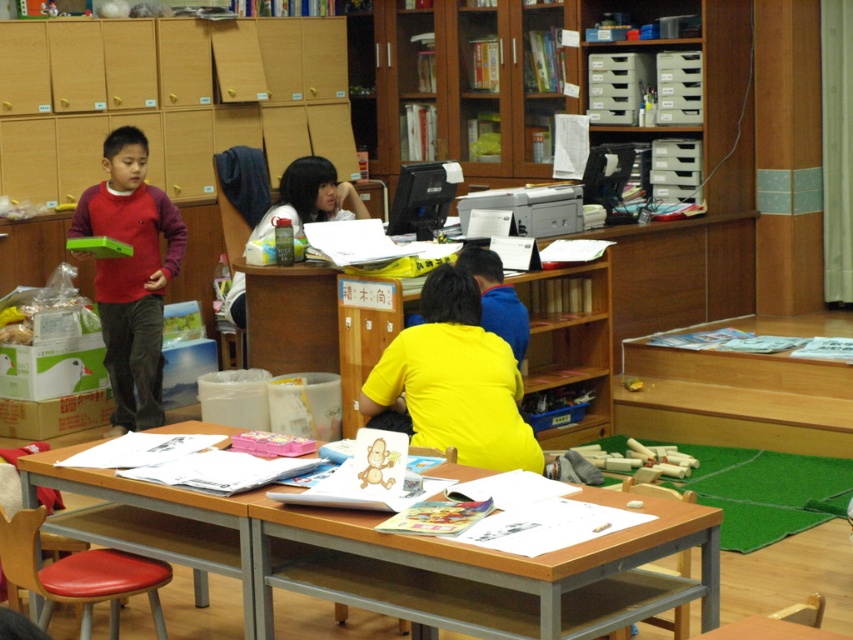
You are a teacher in the classroom and need to place a new poster on the wall. The poster is the same size as the matte red sweater at left. Will the wooden at center desk be able to accommodate the poster if you want to place it there instead?

The wooden at center is bigger than the matte red sweater at left, so the poster will fit on the wooden at center desk.

You are a teacher in the classroom. You see the wooden at center and the matte red sweater at left. Which object is closer to the left side of the room?

The matte red sweater at left is closer to the left side of the room because it is positioned to the left of the wooden at center.